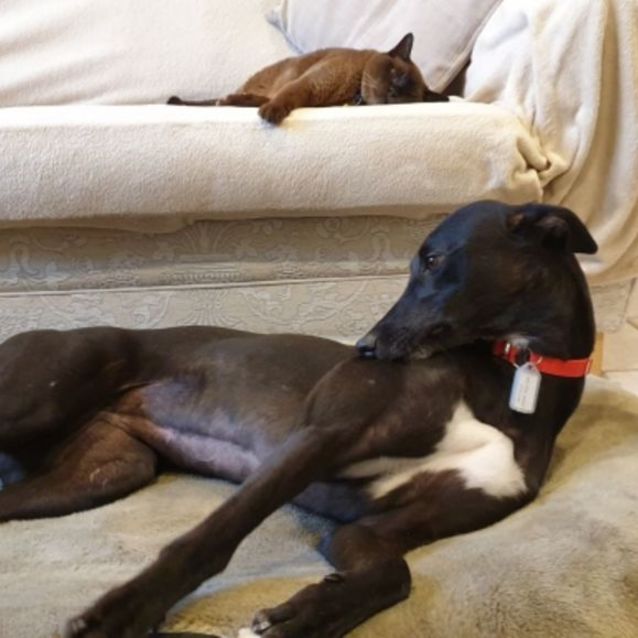
You are a GUI agent. You are given a task and a screenshot of the screen. Output one action in this format:
    pyautogui.click(x=<x>, y=<y>)
    Task: Click on the couch cushions
    
    Given the screenshot: What is the action you would take?
    pyautogui.click(x=239, y=163)